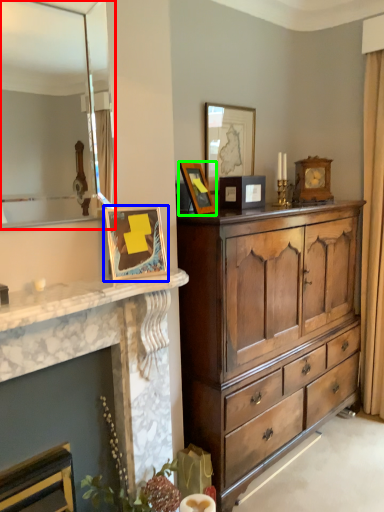
Question: Which object is the farthest from mirror (highlighted by a red box)? Choose among these: picture frame (highlighted by a blue box) or picture frame (highlighted by a green box).

Choices:
 (A) picture frame
 (B) picture frame

Answer: (B)